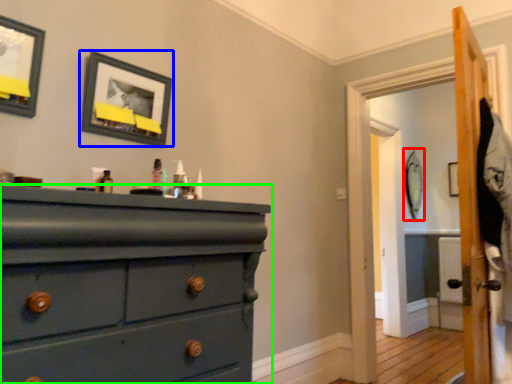
Question: Estimate the real-world distances between objects in this image. Which object is closer to picture frame (highlighted by a red box), picture frame (highlighted by a blue box) or chest of drawers (highlighted by a green box)?

Choices:
 (A) picture frame
 (B) chest of drawers

Answer: (A)